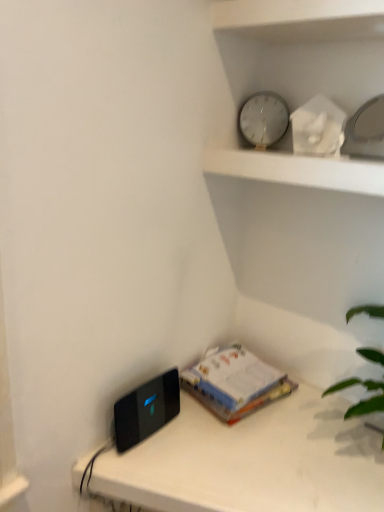
Image resolution: width=384 pixels, height=512 pixels. I want to click on unoccupied area in front of white paper at center, so click(240, 448).